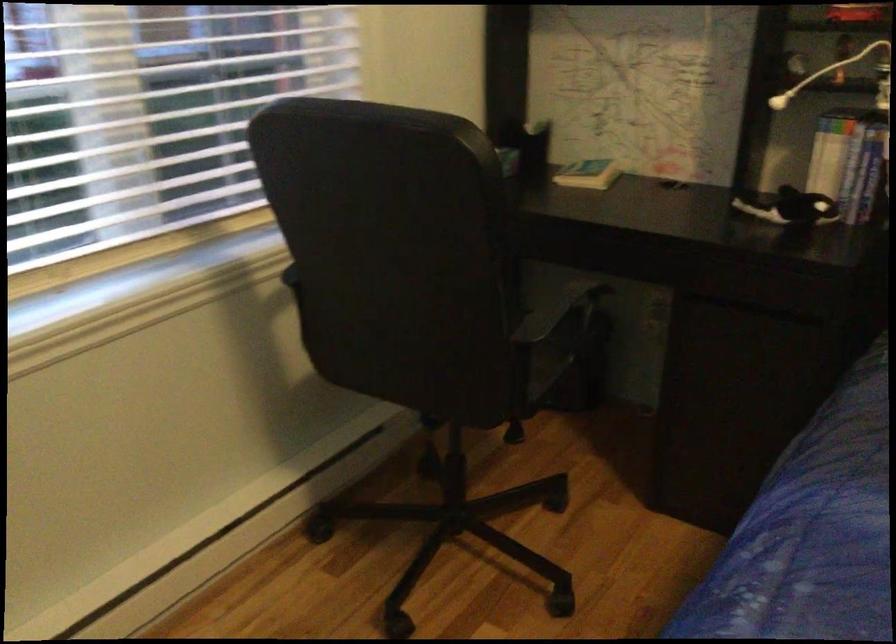
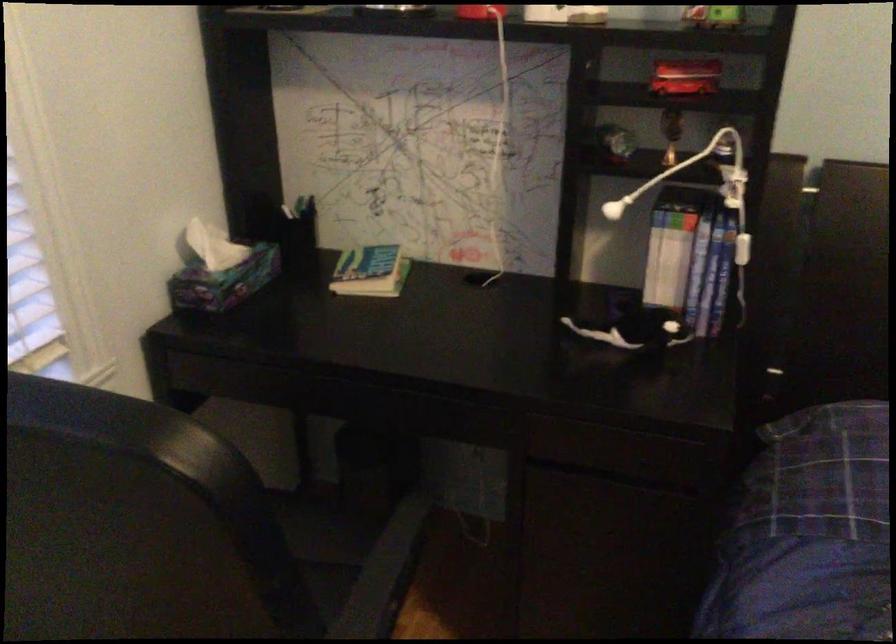
Question: The first image is from the beginning of the video and the second image is from the end. How did the camera likely rotate when shooting the video?

Choices:
 (A) Left
 (B) Right
 (C) Up
 (D) Down

Answer: (B)